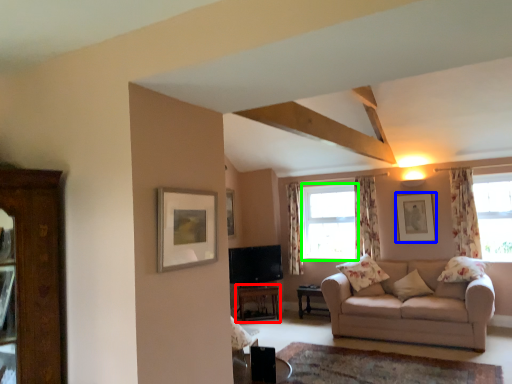
Question: Considering the real-world distances, which object is closest to table (highlighted by a red box)? picture frame (highlighted by a blue box) or window (highlighted by a green box).

Choices:
 (A) picture frame
 (B) window

Answer: (B)